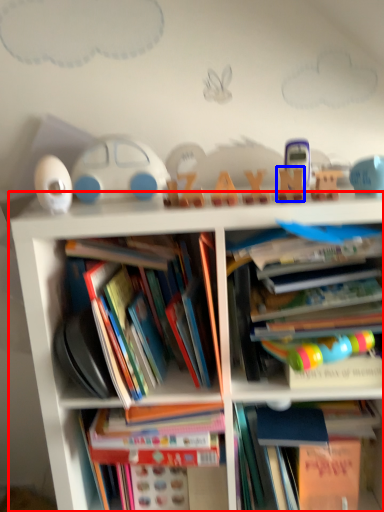
Question: Which object is further to the camera taking this photo, bookcase (highlighted by a red box) or toy (highlighted by a blue box)?

Choices:
 (A) bookcase
 (B) toy

Answer: (B)